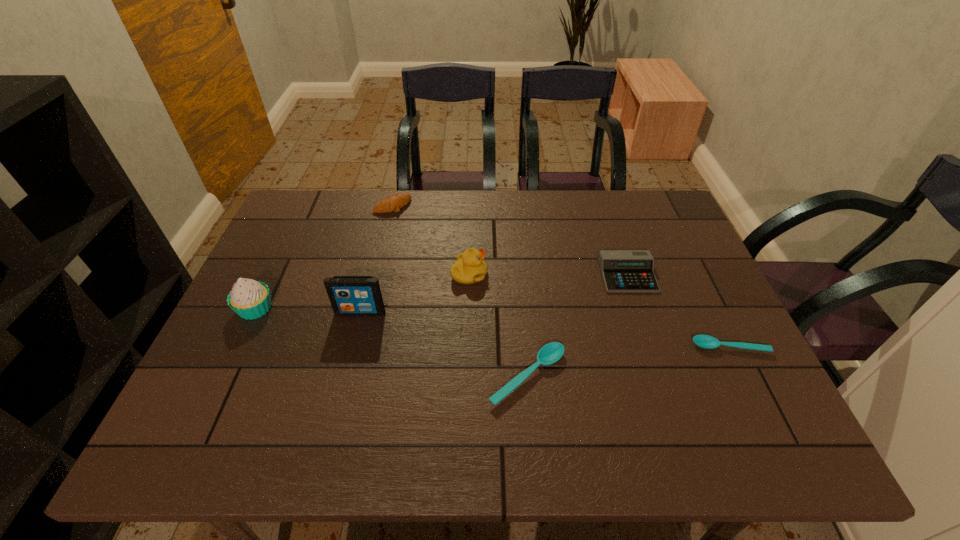
Locate an element on the screen. The image size is (960, 540). free spot located on the left of the shorter spoon is located at coordinates (659, 347).

Find the location of a particular element. This screenshot has width=960, height=540. vacant region located 0.390m on the right of the crescent roll is located at coordinates (528, 206).

What are the coordinates of `vacant space situated 0.230m on the front screen of the iPod` in the screenshot? It's located at (339, 397).

Identify the location of free space located 0.070m on the left of the second object from right to left. Image resolution: width=960 pixels, height=540 pixels. (576, 275).

The height and width of the screenshot is (540, 960). Identify the location of vacant space situated on the beak of the third tallest object. (559, 274).

What are the coordinates of `blank space located 0.270m on the back of the leftmost object` in the screenshot? It's located at (293, 231).

What are the coordinates of `object present at the far edge` in the screenshot? It's located at (394, 202).

The image size is (960, 540). Identify the location of object situated at the near edge. (549, 354).

This screenshot has width=960, height=540. What are the coordinates of `object positioned at the left edge` in the screenshot? It's located at [x=250, y=299].

The height and width of the screenshot is (540, 960). What are the coordinates of `spoon that is at the right edge` in the screenshot? It's located at (704, 341).